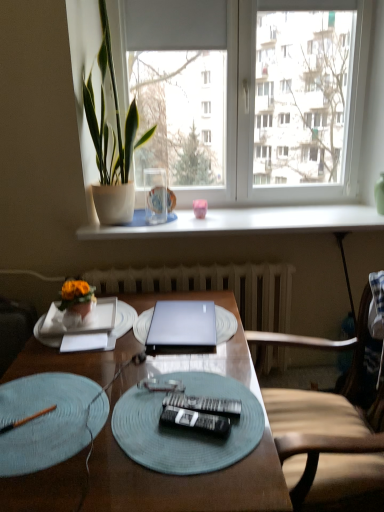
Locate an element on the screen. The height and width of the screenshot is (512, 384). vacant area that lies in front of orange wood pen at lower left is located at coordinates (31, 462).